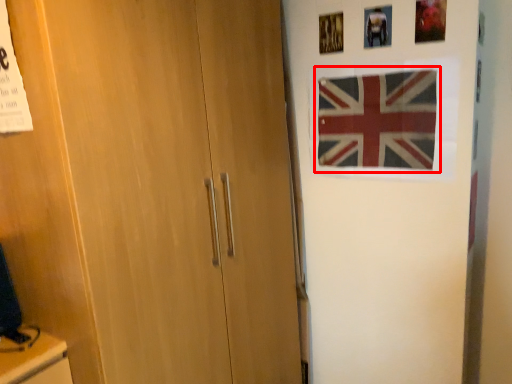
Question: Where is flag (annotated by the red box) located in relation to picture frame in the image?

Choices:
 (A) left
 (B) right

Answer: (B)